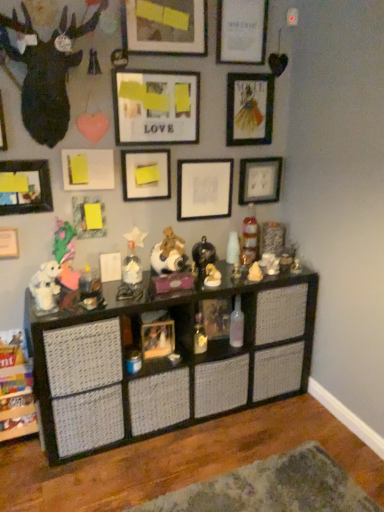
Question: Is matte white picture frame at lower left, the eleventh picture frame positioned from the top, with matte black picture frame at upper center, marked as the 12th picture frame in a bottom-to-top arrangement?

Choices:
 (A) yes
 (B) no

Answer: (B)

Question: Is matte white picture frame at lower left, the eleventh picture frame positioned from the top, taller than matte black picture frame at upper center, placed as the 2th picture frame when sorted from top to bottom?

Choices:
 (A) yes
 (B) no

Answer: (B)

Question: Is matte white picture frame at lower left, positioned as the third picture frame in bottom-to-top order, closer to the viewer compared to matte black picture frame at upper center, marked as the 12th picture frame in a bottom-to-top arrangement?

Choices:
 (A) yes
 (B) no

Answer: (B)

Question: Considering the relative positions of matte white picture frame at lower left, positioned as the third picture frame in bottom-to-top order, and matte black picture frame at upper center, placed as the 2th picture frame when sorted from top to bottom, in the image provided, is matte white picture frame at lower left, positioned as the third picture frame in bottom-to-top order, to the left of matte black picture frame at upper center, placed as the 2th picture frame when sorted from top to bottom, from the viewer's perspective?

Choices:
 (A) no
 (B) yes

Answer: (B)

Question: From a real-world perspective, is matte white picture frame at lower left, the eleventh picture frame positioned from the top, beneath matte black picture frame at upper center, placed as the 2th picture frame when sorted from top to bottom?

Choices:
 (A) yes
 (B) no

Answer: (A)

Question: Visually, is white matte bottle at center, the second toy positioned from the left, positioned to the left or to the right of fluffy pink stuffed animal at center-left, the first toy from the left?

Choices:
 (A) left
 (B) right

Answer: (B)

Question: Is white matte bottle at center, positioned as the 10th toy in right-to-left order, taller or shorter than fluffy pink stuffed animal at center-left, the 11th toy from the right?

Choices:
 (A) tall
 (B) short

Answer: (B)

Question: Does point (130, 280) appear closer or farther from the camera than point (69, 276)?

Choices:
 (A) closer
 (B) farther

Answer: (A)

Question: In terms of size, does white matte bottle at center, the second toy positioned from the left, appear bigger or smaller than fluffy pink stuffed animal at center-left, the 11th toy from the right?

Choices:
 (A) small
 (B) big

Answer: (A)

Question: Considering the positions of white matte bottle at center, the second toy positioned from the left, and brushed metal picture frame at upper left, the fifth picture frame in the top-to-bottom sequence, in the image, is white matte bottle at center, the second toy positioned from the left, taller or shorter than brushed metal picture frame at upper left, the fifth picture frame in the top-to-bottom sequence,?

Choices:
 (A) tall
 (B) short

Answer: (B)

Question: Would you say white matte bottle at center, positioned as the 10th toy in right-to-left order, is inside or outside brushed metal picture frame at upper left, which ranks as the ninth picture frame in bottom-to-top order?

Choices:
 (A) inside
 (B) outside

Answer: (B)

Question: From a real-world perspective, is white matte bottle at center, the second toy positioned from the left, above or below brushed metal picture frame at upper left, which ranks as the ninth picture frame in bottom-to-top order?

Choices:
 (A) above
 (B) below

Answer: (B)

Question: Considering the positions of white matte bottle at center, the second toy positioned from the left, and brushed metal picture frame at upper left, the fifth picture frame in the top-to-bottom sequence, in the image, is white matte bottle at center, the second toy positioned from the left, bigger or smaller than brushed metal picture frame at upper left, the fifth picture frame in the top-to-bottom sequence,?

Choices:
 (A) small
 (B) big

Answer: (B)

Question: From the image's perspective, is matte black picture frame at left, which is counted as the tenth picture frame, starting from the top, located above or below matte black picture frame at upper right, marked as the third picture frame in a top-to-bottom arrangement?

Choices:
 (A) below
 (B) above

Answer: (A)

Question: Is matte black picture frame at left, which is counted as the tenth picture frame, starting from the top, situated inside matte black picture frame at upper right, marked as the third picture frame in a top-to-bottom arrangement, or outside?

Choices:
 (A) inside
 (B) outside

Answer: (B)